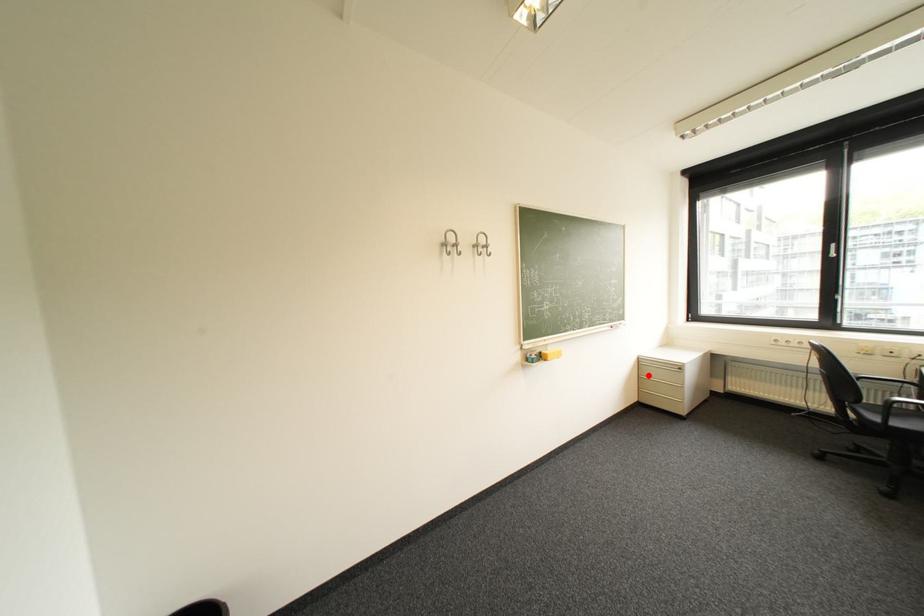
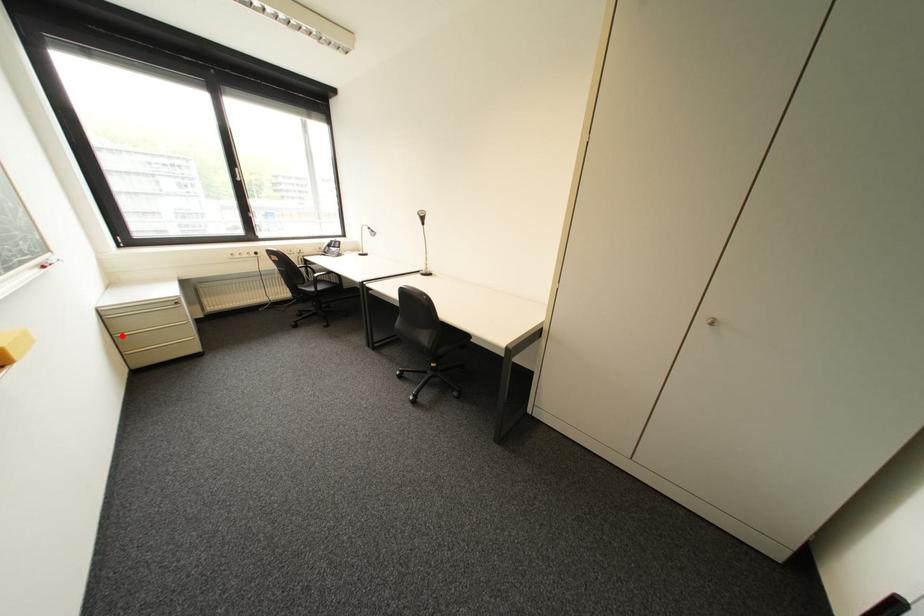
I am providing you with two images of the same scene from different viewpoints. A red point is marked on the first image and another point is marked on the second image. Are the points marked in image1 and image2 representing the same 3D position?

Yes